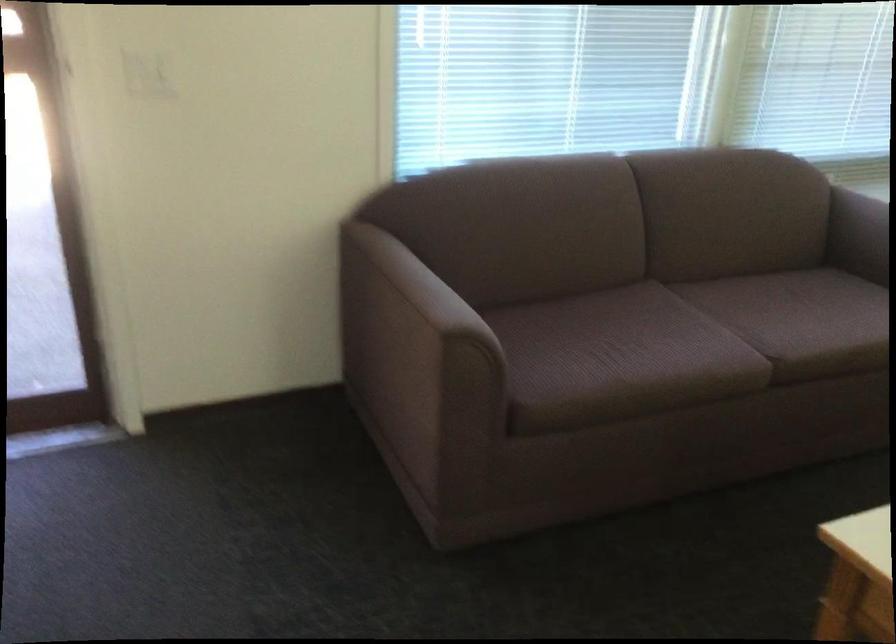
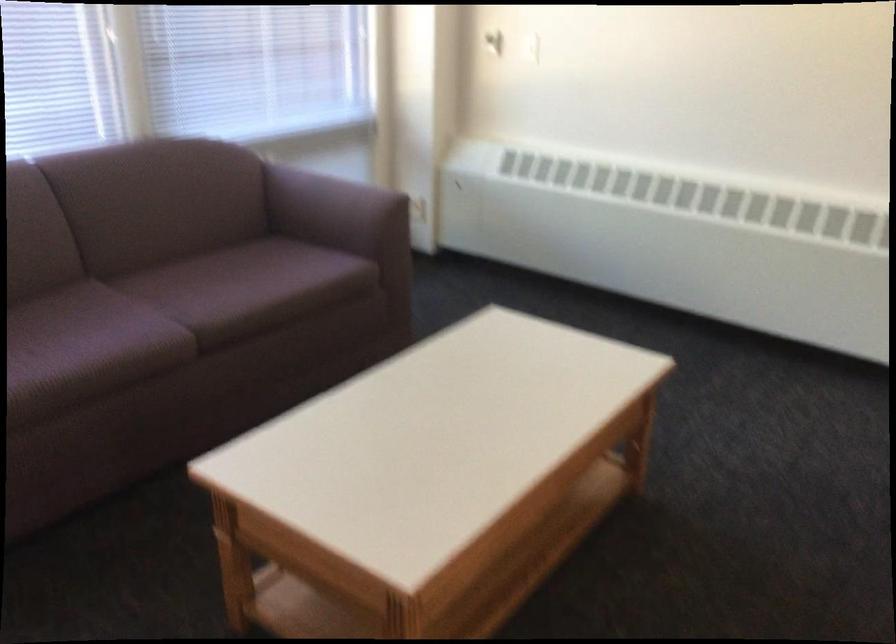
Question: The first image is from the beginning of the video and the second image is from the end. How did the camera likely rotate when shooting the video?

Choices:
 (A) Left
 (B) Right
 (C) Up
 (D) Down

Answer: (B)